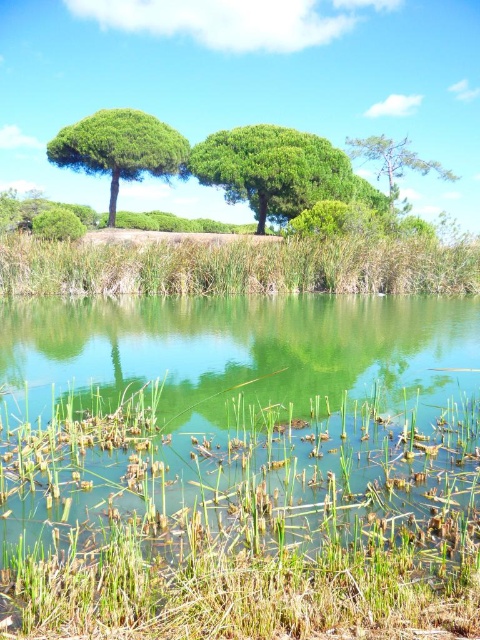
Question: Which object is closer to the camera taking this photo?

Choices:
 (A) green matte tree at upper left
 (B) green grassy lake at bottom
 (C) green leafy tree at center
 (D) green grassy reed at lower center

Answer: (B)

Question: Does green grassy lake at bottom appear over green matte tree at upper right?

Choices:
 (A) no
 (B) yes

Answer: (A)

Question: Which of the following is the farthest from the observer?

Choices:
 (A) (297, 148)
 (B) (334, 412)
 (C) (324, 241)
 (D) (137, 147)

Answer: (A)

Question: Which point is farther from the camera taking this photo?

Choices:
 (A) (253, 474)
 (B) (97, 113)
 (C) (407, 166)
 (D) (248, 177)

Answer: (C)

Question: Does green grassy lake at bottom appear on the left side of green leafy tree at center?

Choices:
 (A) yes
 (B) no

Answer: (A)

Question: Is green grassy reed at lower center closer to the viewer compared to green matte tree at upper left?

Choices:
 (A) no
 (B) yes

Answer: (B)